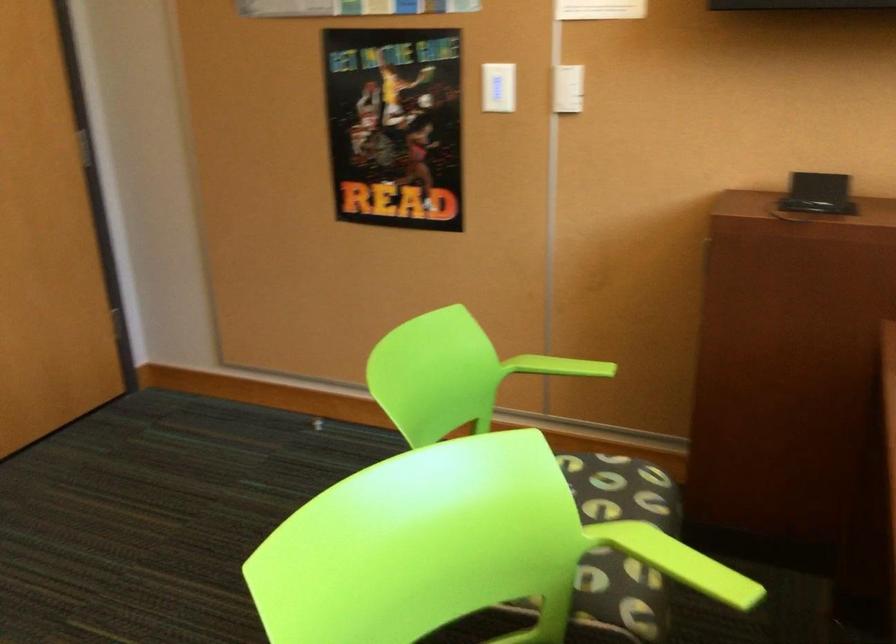
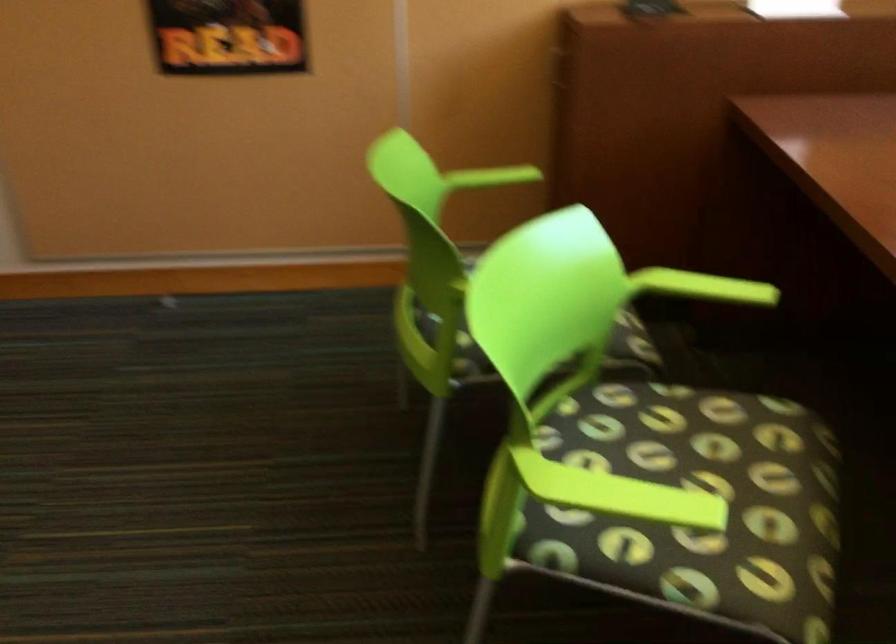
Question: The first image is from the beginning of the video and the second image is from the end. How did the camera likely rotate when shooting the video?

Choices:
 (A) Left
 (B) Right
 (C) Up
 (D) Down

Answer: (B)